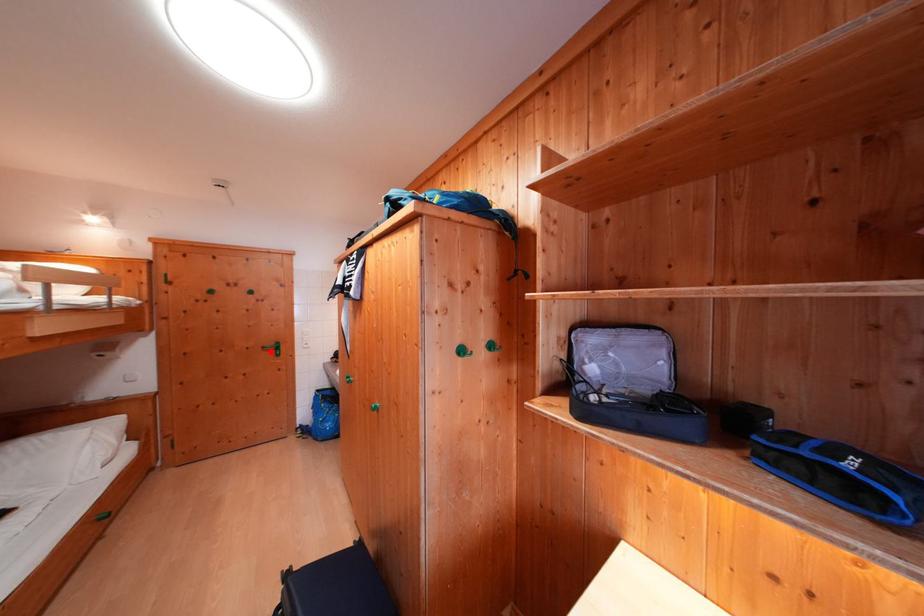
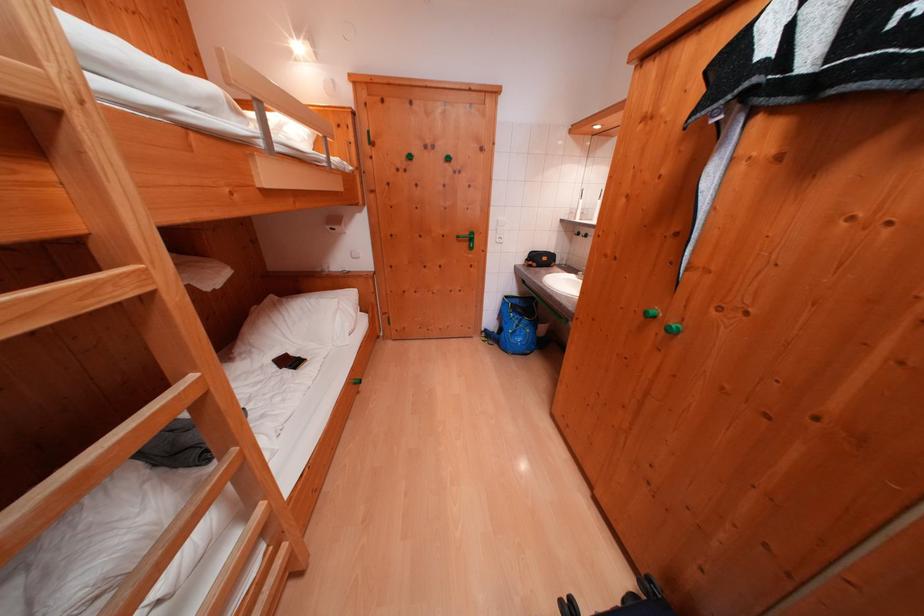
Question: A red point is marked in image1. In image2, is the corresponding 3D point closer to the camera or farther? Reply with the corresponding letter.

Choices:
 (A) The corresponding 3D point is closer.
 (B) The corresponding 3D point is farther.

Answer: (A)